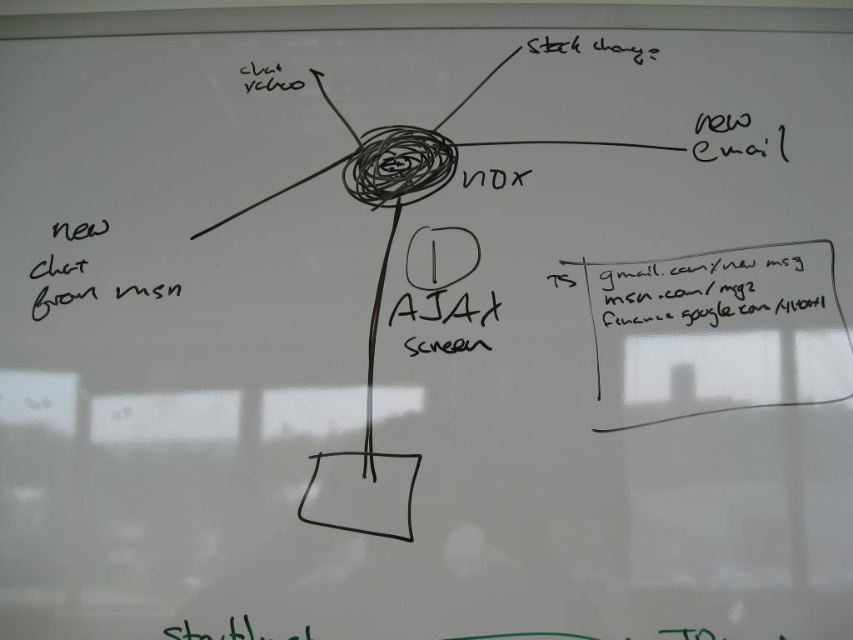
Can you confirm if black text at upper right is positioned below black handwritten text at lower left?

Indeed, black text at upper right is positioned under black handwritten text at lower left.

Is black text at upper right positioned behind black handwritten text at lower left?

Yes, it is.

What do you see at coordinates (715, 285) in the screenshot?
I see `black text at upper right` at bounding box center [715, 285].

In order to click on black text at upper right in this screenshot , I will do `click(715, 285)`.